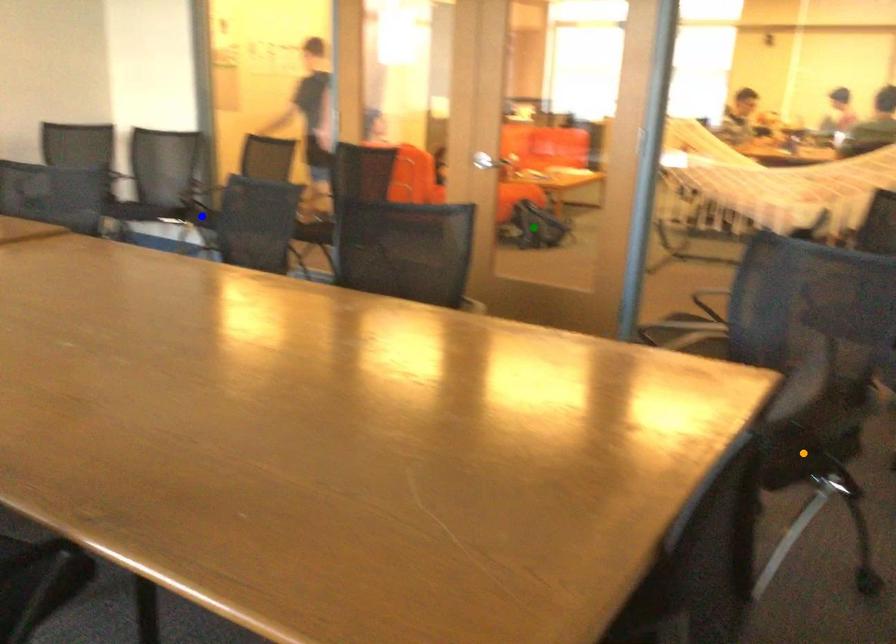
Order these from nearest to farthest:
1. green point
2. blue point
3. orange point

green point
blue point
orange point